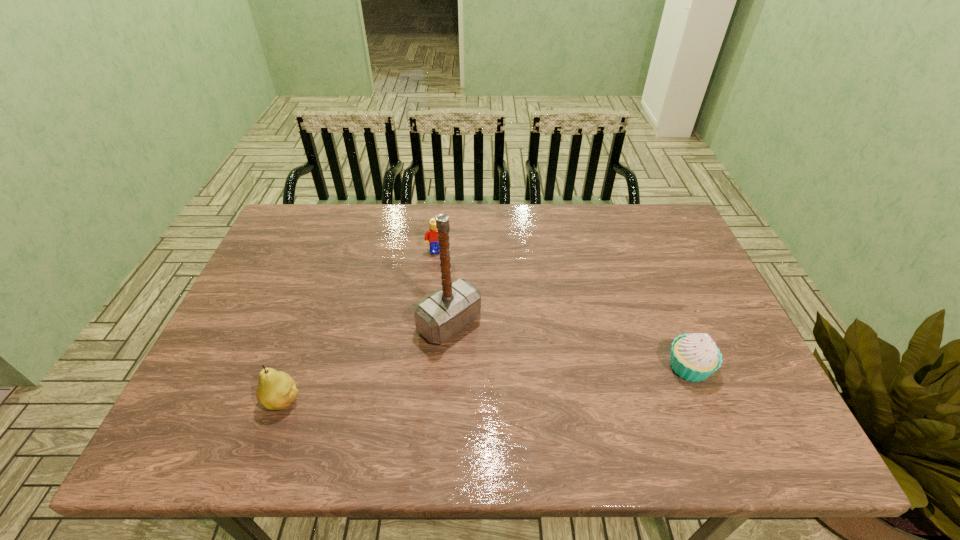
At what (x,y) coordinates should I click in order to perform the action: click on vacant space located 0.180m on the striking surface of the third nearest object. Please return your answer as a coordinate pair (x, y). Image resolution: width=960 pixels, height=540 pixels. Looking at the image, I should click on [x=524, y=387].

Locate an element on the screen. free space located 0.260m on the striking surface of the third nearest object is located at coordinates (551, 409).

The image size is (960, 540). Identify the location of free region located on the striking surface of the third nearest object. (515, 378).

Identify the location of object that is at the far edge. (431, 234).

Where is `pear that is at the near edge`? The width and height of the screenshot is (960, 540). pear that is at the near edge is located at coordinates (276, 390).

Locate an element on the screen. cupcake that is positioned at the near edge is located at coordinates (694, 357).

Identify the location of object positioned at the right edge. This screenshot has width=960, height=540. (694, 357).

At what (x,y) coordinates should I click in order to perform the action: click on object that is at the near right corner. Please return your answer as a coordinate pair (x, y). The image size is (960, 540). Looking at the image, I should click on (694, 357).

This screenshot has height=540, width=960. In order to click on free space at the far edge of the desktop in this screenshot , I will do (368, 232).

Find the location of a particular element. This screenshot has width=960, height=540. free region at the near edge of the desktop is located at coordinates pyautogui.click(x=443, y=411).